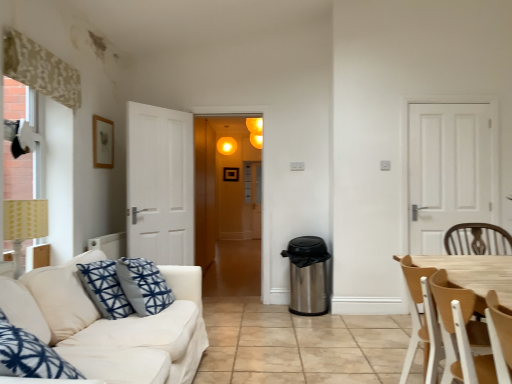
Locate an element on the screen. This screenshot has height=384, width=512. camouflage fabric curtain at upper left is located at coordinates (41, 69).

You are a GUI agent. You are given a task and a screenshot of the screen. Output one action in this format:
    pyautogui.click(x=<x>, y=<y>)
    Task: Click on the blue printed cushion at left, positioned as the first pillow in right-to-left order
    Image resolution: width=512 pixels, height=384 pixels.
    Given the screenshot: What is the action you would take?
    pyautogui.click(x=63, y=296)

In order to click on blue printed cushion at lower left, positioned as the 2th pillow in right-to-left order in this screenshot , I will do `click(22, 309)`.

What are the coordinates of `chair below the matte yellow light at upper center (from a real-world perspective)` in the screenshot? It's located at (451, 265).

Can you confirm if matte yellow light at upper center is wider than light brown wood chair at right?

Incorrect, the width of matte yellow light at upper center does not surpass that of light brown wood chair at right.

From a real-world perspective, is matte yellow light at upper center over light brown wood chair at right?

Yes, from a real-world perspective, matte yellow light at upper center is on top of light brown wood chair at right.

Can you confirm if blue printed cushion at lower left, arranged as the first pillow when viewed from the left, is shorter than white fabric couch at lower left?

Correct, blue printed cushion at lower left, arranged as the first pillow when viewed from the left, is not as tall as white fabric couch at lower left.

Choose the correct answer: Is blue printed cushion at lower left, arranged as the first pillow when viewed from the left, inside white fabric couch at lower left or outside it?

The correct answer is: inside.

Does blue printed cushion at lower left, arranged as the first pillow when viewed from the left, turn towards white fabric couch at lower left?

Yes, blue printed cushion at lower left, arranged as the first pillow when viewed from the left, is turned towards white fabric couch at lower left.

From the image's perspective, is blue printed cushion at lower left, arranged as the first pillow when viewed from the left, above white fabric couch at lower left?

Indeed, from the image's perspective, blue printed cushion at lower left, arranged as the first pillow when viewed from the left, is shown above white fabric couch at lower left.

Looking at this image, is white matte door at right directly adjacent to blue printed cushion at lower left, arranged as the first pillow when viewed from the left?

No, white matte door at right is not touching blue printed cushion at lower left, arranged as the first pillow when viewed from the left.

This screenshot has height=384, width=512. Find the location of `door behind the blue printed cushion at lower left, positioned as the 2th pillow in right-to-left order`. door behind the blue printed cushion at lower left, positioned as the 2th pillow in right-to-left order is located at coordinates (447, 171).

Based on their positions, is white matte door at right located to the left or right of blue printed cushion at lower left, arranged as the first pillow when viewed from the left?

Clearly, white matte door at right is on the right of blue printed cushion at lower left, arranged as the first pillow when viewed from the left, in the image.

Which of these two, white matte door at right or blue printed cushion at lower left, arranged as the first pillow when viewed from the left, is thinner?

white matte door at right.

How different are the orientations of white fabric couch at lower left and light brown wood chair at right in degrees?

They differ by 4.29 degrees in their facing directions.

Could you tell me if white fabric couch at lower left is turned towards light brown wood chair at right?

Yes, white fabric couch at lower left is aimed at light brown wood chair at right.

The height and width of the screenshot is (384, 512). What are the coordinates of `chair above the white fabric couch at lower left (from the image's perspective)` in the screenshot? It's located at (451, 265).

Would you say white fabric couch at lower left is inside or outside light brown wood chair at right?

white fabric couch at lower left cannot be found inside light brown wood chair at right.

You are a GUI agent. You are given a task and a screenshot of the screen. Output one action in this format:
    pyautogui.click(x=<x>, y=<y>)
    Task: Click on the curtain located on the left of white matte door at right
    This screenshot has width=512, height=384.
    Given the screenshot: What is the action you would take?
    41,69

Which object is wider, camouflage fabric curtain at upper left or white matte door at right?

camouflage fabric curtain at upper left is wider.

Is point (17, 52) more distant than point (478, 165)?

No, it is in front of (478, 165).

Considering the relative positions of camouflage fabric curtain at upper left and white matte door at right in the image provided, is camouflage fabric curtain at upper left to the right of white matte door at right from the viewer's perspective?

No.

From the picture: Considering the relative positions of white matte door at right and blue printed cushion at left, positioned as the first pillow in right-to-left order, in the image provided, is white matte door at right in front of blue printed cushion at left, positioned as the first pillow in right-to-left order,?

No, white matte door at right is behind blue printed cushion at left, positioned as the first pillow in right-to-left order.

Which pillow is the 2nd one when counting from the front of the white matte door at right? Please provide its 2D coordinates.

[(63, 296)]

Considering the points (457, 127) and (32, 295), which point is behind, point (457, 127) or point (32, 295)?

The point (457, 127) is farther.

Considering the sizes of objects camouflage fabric curtain at upper left and white fabric couch at lower left in the image provided, who is wider, camouflage fabric curtain at upper left or white fabric couch at lower left?

white fabric couch at lower left.

Measure the distance from camouflage fabric curtain at upper left to white fabric couch at lower left.

camouflage fabric curtain at upper left and white fabric couch at lower left are 4.84 feet apart from each other.

From the picture: Is camouflage fabric curtain at upper left taller or shorter than white fabric couch at lower left?

camouflage fabric curtain at upper left is shorter than white fabric couch at lower left.

Is camouflage fabric curtain at upper left completely or partially outside of white fabric couch at lower left?

Yes, camouflage fabric curtain at upper left is located beyond the bounds of white fabric couch at lower left.

Image resolution: width=512 pixels, height=384 pixels. In the image, there is a matte yellow light at upper center. Identify the location of chair below it (from a real-world perspective). (451, 265).

From a real-world perspective, starting from the white fabric couch at lower left, which pillow is the 2nd one vertically above it? Please provide its 2D coordinates.

[(22, 309)]

Which object lies further to the anchor point white matte door at right, translucent glass screen door at center or matte yellow light at upper center?

matte yellow light at upper center is positioned further to the anchor white matte door at right.

Considering their positions, is light brown wood chair at right positioned closer to matte yellow lampshade at left than translucent glass screen door at center?

Based on the image, light brown wood chair at right appears to be nearer to matte yellow lampshade at left.

Which object lies further to the anchor point light brown wood chair at right, blue printed cushion at left, positioned as the first pillow in right-to-left order, or blue printed cushion at lower left, positioned as the 2th pillow in right-to-left order?

blue printed cushion at lower left, positioned as the 2th pillow in right-to-left order.

Considering their positions, is camouflage fabric curtain at upper left positioned closer to matte yellow lampshade at left than blue printed cushion at left, which ranks as the 2th pillow in left-to-right order?

blue printed cushion at left, which ranks as the 2th pillow in left-to-right order, is closer to matte yellow lampshade at left.

From the image, which object appears to be nearer to blue printed cushion at lower left, arranged as the first pillow when viewed from the left, matte yellow lampshade at left or blue printed cushion at left, which ranks as the 2th pillow in left-to-right order?

Among the two, blue printed cushion at left, which ranks as the 2th pillow in left-to-right order, is located nearer to blue printed cushion at lower left, arranged as the first pillow when viewed from the left.

Based on their spatial positions, is matte yellow lampshade at left or light brown wood chair at right closer to blue printed cushion at left, which ranks as the 2th pillow in left-to-right order?

matte yellow lampshade at left lies closer to blue printed cushion at left, which ranks as the 2th pillow in left-to-right order, than the other object.

Looking at the image, which one is located closer to matte yellow lampshade at left, light brown wood chair at right or camouflage fabric curtain at upper left?

camouflage fabric curtain at upper left lies closer to matte yellow lampshade at left than the other object.

Which object lies nearer to the anchor point white fabric couch at lower left, white matte door at right or light brown wood chair at right?

light brown wood chair at right.

Identify the location of studio couch situated between camouflage fabric curtain at upper left and light brown wood chair at right from left to right. The image size is (512, 384). (111, 325).

Identify the location of pillow positioned between blue printed cushion at left, positioned as the first pillow in right-to-left order, and translucent glass screen door at center from near to far. (22, 309).

This screenshot has width=512, height=384. In order to click on screen door positioned between blue printed cushion at left, which ranks as the 2th pillow in left-to-right order, and matte yellow light at upper center from near to far in this screenshot , I will do `click(225, 186)`.

Locate an element on the screen. Image resolution: width=512 pixels, height=384 pixels. pillow between white fabric couch at lower left and blue printed cushion at lower left, arranged as the first pillow when viewed from the left, in the front-back direction is located at coordinates (63, 296).